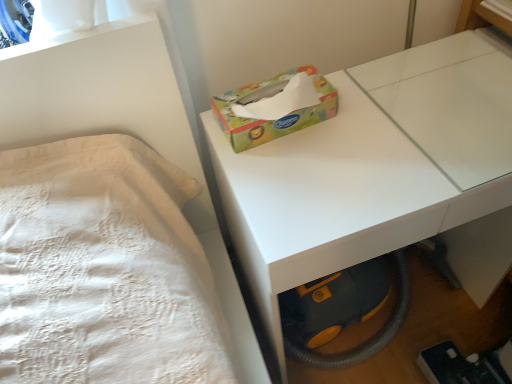
Question: In which direction should I rotate to look at multicolored cardboard tissue box at center?

Choices:
 (A) right
 (B) left

Answer: (A)

Question: From a real-world perspective, is white glossy table at center under multicolored cardboard tissue box at center?

Choices:
 (A) yes
 (B) no

Answer: (A)

Question: Considering the relative sizes of white glossy table at center and multicolored cardboard tissue box at center in the image provided, is white glossy table at center taller than multicolored cardboard tissue box at center?

Choices:
 (A) no
 (B) yes

Answer: (B)

Question: Is white glossy table at center beside multicolored cardboard tissue box at center?

Choices:
 (A) yes
 (B) no

Answer: (B)

Question: Is white glossy table at center positioned before multicolored cardboard tissue box at center?

Choices:
 (A) no
 (B) yes

Answer: (B)

Question: Is white glossy table at center at the left side of multicolored cardboard tissue box at center?

Choices:
 (A) no
 (B) yes

Answer: (A)

Question: Can you confirm if white glossy table at center is wider than multicolored cardboard tissue box at center?

Choices:
 (A) yes
 (B) no

Answer: (A)

Question: Is multicolored cardboard tissue box at center with white glossy table at center?

Choices:
 (A) no
 (B) yes

Answer: (A)

Question: Can you confirm if multicolored cardboard tissue box at center is positioned to the left of white glossy table at center?

Choices:
 (A) yes
 (B) no

Answer: (A)

Question: Considering the relative sizes of multicolored cardboard tissue box at center and white glossy table at center in the image provided, is multicolored cardboard tissue box at center shorter than white glossy table at center?

Choices:
 (A) no
 (B) yes

Answer: (B)

Question: Is multicolored cardboard tissue box at center looking in the opposite direction of white glossy table at center?

Choices:
 (A) yes
 (B) no

Answer: (B)

Question: Would you consider multicolored cardboard tissue box at center to be distant from white glossy table at center?

Choices:
 (A) yes
 (B) no

Answer: (B)

Question: Could you tell me if multicolored cardboard tissue box at center is facing white glossy table at center?

Choices:
 (A) yes
 (B) no

Answer: (B)

Question: From a real-world perspective, is white glossy table at center physically located above or below multicolored cardboard tissue box at center?

Choices:
 (A) above
 (B) below

Answer: (B)